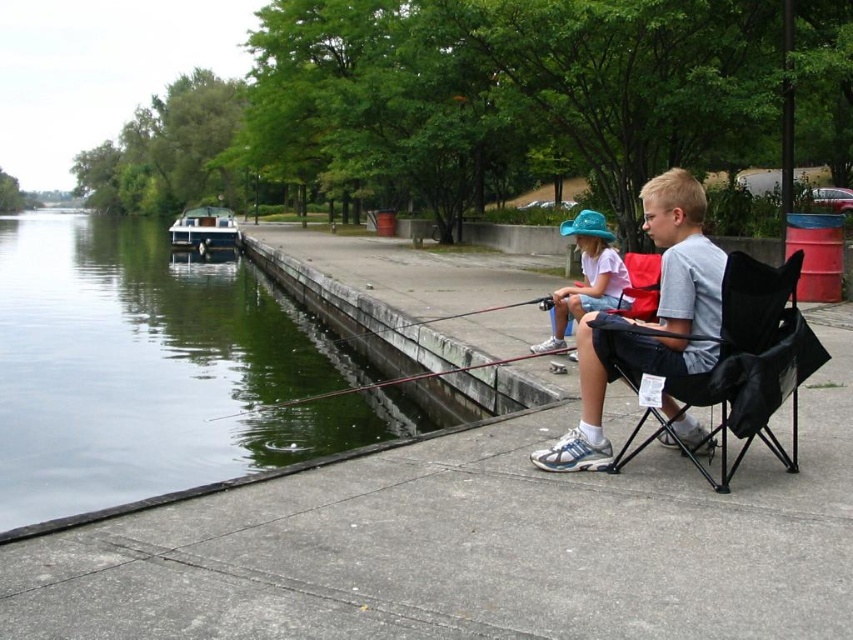
Looking at this image, you are a photographer wanting to capture both children in a single frame. Given the positions of the gray fabric chair at center and the black fabric chair at right, which chair is closer to the edge of the walkway?

The gray fabric chair at center is closer to the edge of the walkway because it is smaller in size compared to the black fabric chair at right.

You are a photographer trying to capture the two children fishing. You notice the light blue fabric hat at upper center and the smooth plastic rod at center. Which object has a smaller width?

The light blue fabric hat at upper center has a smaller width than the smooth plastic rod at center.